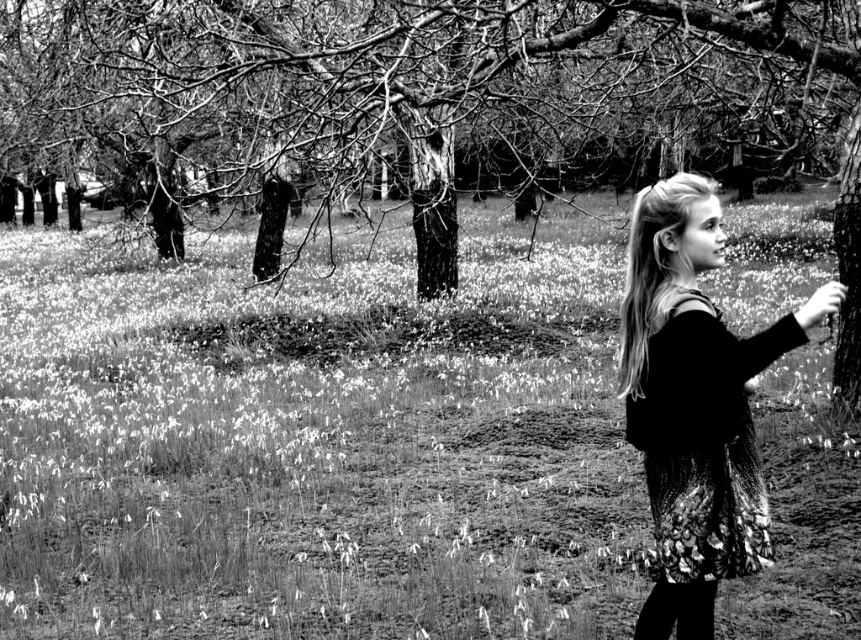
Which is above, white grass at center or knitted sweater at right?

white grass at center

Which is below, white grass at center or knitted sweater at right?

knitted sweater at right is lower down.

Image resolution: width=861 pixels, height=640 pixels. Identify the location of white grass at center. (317, 440).

Does white grass at center have a larger size compared to rough bark tree at upper center?

No.

The height and width of the screenshot is (640, 861). Describe the element at coordinates (317, 440) in the screenshot. I see `white grass at center` at that location.

Measure the distance between white grass at center and camera.

white grass at center is 4.67 meters from camera.

I want to click on white grass at center, so click(317, 440).

Measure the distance from rough bark tree at upper center to knitted sweater at right.

rough bark tree at upper center is 9.14 meters from knitted sweater at right.

The width and height of the screenshot is (861, 640). In order to click on rough bark tree at upper center in this screenshot , I will do `click(311, 60)`.